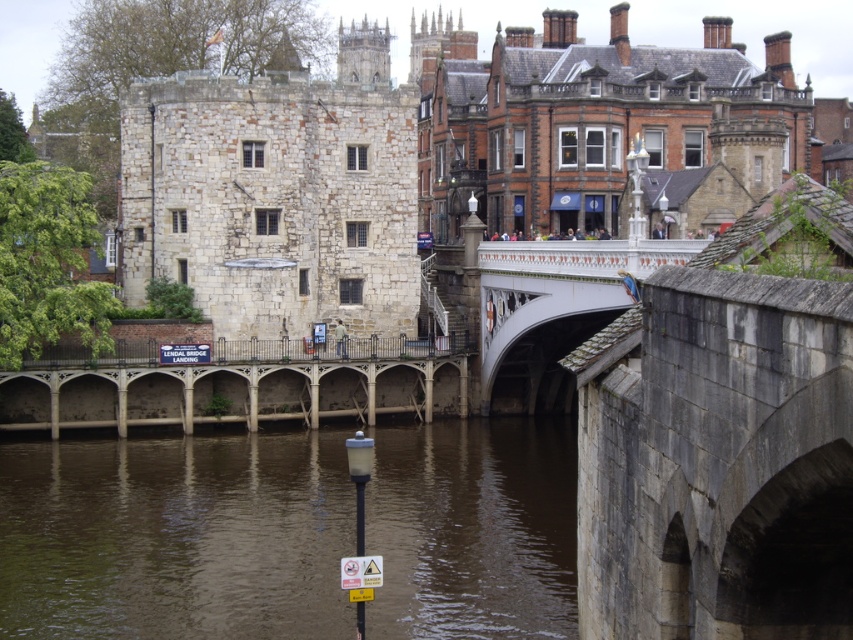
Is stone arches at center taller than white stone bridge at center?

No, stone arches at center is not taller than white stone bridge at center.

Is stone arches at center smaller than white stone bridge at center?

Correct, stone arches at center occupies less space than white stone bridge at center.

Is point (468, 360) closer to camera compared to point (514, 340)?

No, (468, 360) is further to viewer.

Where is `stone arches at center`? stone arches at center is located at coordinates (244, 387).

Is stone castle at center shorter than stone arches at center?

No.

Between point (364, 29) and point (225, 369), which one is positioned behind?

The point (364, 29) is more distant.

I want to click on stone castle at center, so click(589, 120).

Between brown water at lower center and white stone bridge at center, which one has less height?

brown water at lower center

Which is in front, point (33, 605) or point (585, 241)?

Point (33, 605) is more forward.

Between point (294, 611) and point (512, 266), which one is positioned behind?

The point (512, 266) is more distant.

Find the location of a particular element. The height and width of the screenshot is (640, 853). brown water at lower center is located at coordinates (175, 536).